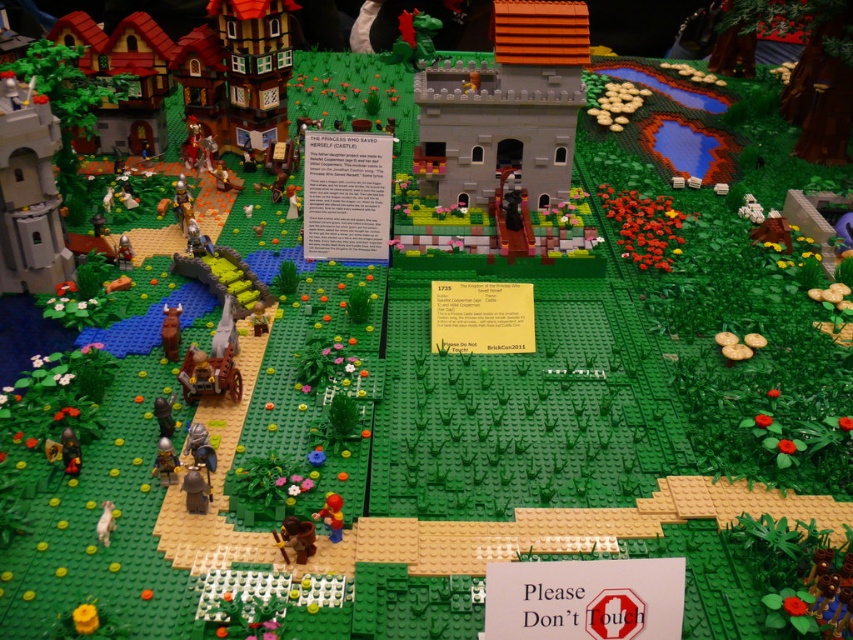
Which of these two, light gray stone tower at left or matte black figure at lower left, stands taller?

Standing taller between the two is light gray stone tower at left.

Is light gray stone tower at left to the right of matte black figure at lower left from the viewer's perspective?

Incorrect, light gray stone tower at left is not on the right side of matte black figure at lower left.

Between point (33, 134) and point (173, 468), which one is positioned behind?

The point (33, 134) is behind.

Where is `light gray stone tower at left`? light gray stone tower at left is located at coordinates (28, 193).

Is point (164, 464) behind point (321, 518)?

Yes, it is behind point (321, 518).

Between matte black figure at lower left and bright red plastic figure at center, which one has less height?

With less height is bright red plastic figure at center.

The height and width of the screenshot is (640, 853). In order to click on matte black figure at lower left in this screenshot , I will do `click(165, 461)`.

Which is below, bright red plastic figure at center or light brown wooden horse at lower left?

light brown wooden horse at lower left

Can you confirm if bright red plastic figure at center is positioned below light brown wooden horse at lower left?

Actually, bright red plastic figure at center is above light brown wooden horse at lower left.

Is point (331, 522) positioned behind point (113, 508)?

No, (331, 522) is in front of (113, 508).

Where is `bright red plastic figure at center`? bright red plastic figure at center is located at coordinates (331, 515).